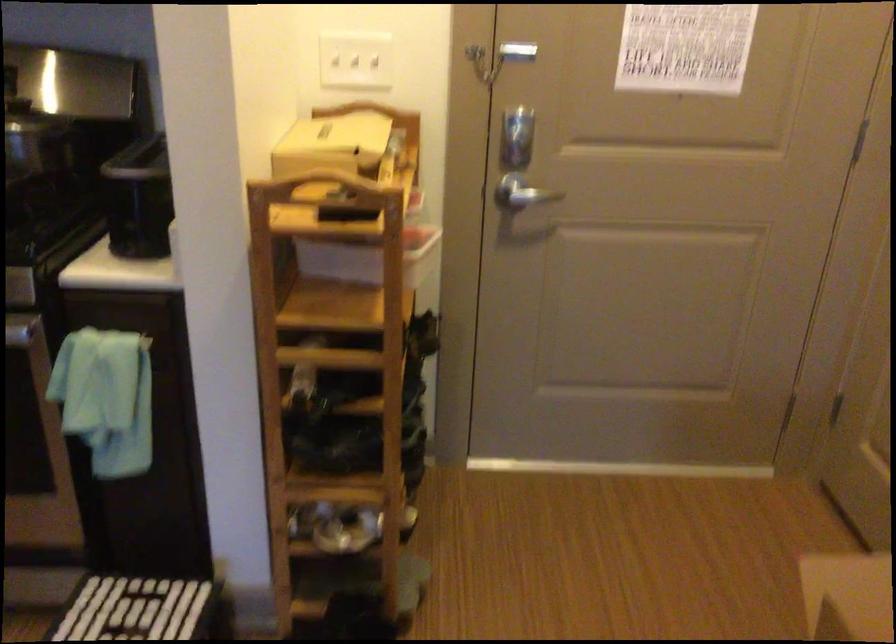
Where is `door chain lock`? door chain lock is located at coordinates (478, 57).